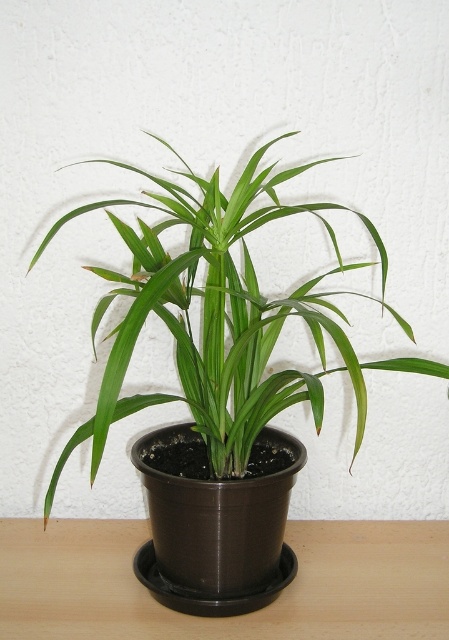
Question: Which of the following is the closest to the observer?

Choices:
 (A) (106, 580)
 (B) (159, 186)

Answer: (A)

Question: Is green matte plant at center bigger than brown wooden table at center?

Choices:
 (A) yes
 (B) no

Answer: (A)

Question: Can you confirm if green matte plant at center is wider than brown wooden table at center?

Choices:
 (A) yes
 (B) no

Answer: (B)

Question: Which point is farther to the camera?

Choices:
 (A) (357, 376)
 (B) (74, 609)

Answer: (B)

Question: Does green matte plant at center appear over brown wooden table at center?

Choices:
 (A) no
 (B) yes

Answer: (B)